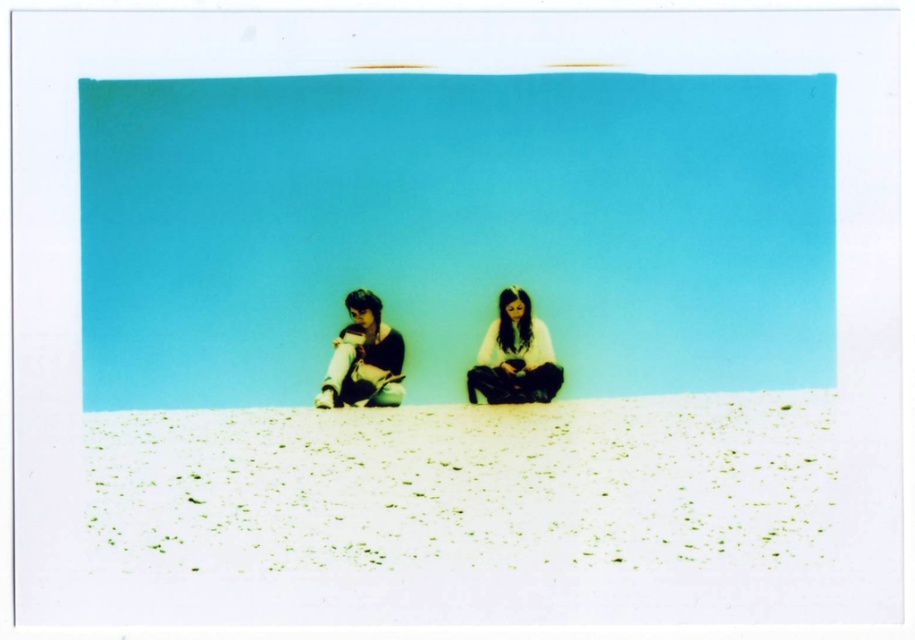
Question: Which of the following is the closest to the observer?

Choices:
 (A) white sandy ground at lower center
 (B) white matte shirt at center
 (C) matte white pants at center left

Answer: (A)

Question: Does white matte shirt at center appear on the right side of matte white pants at center left?

Choices:
 (A) yes
 (B) no

Answer: (A)

Question: Estimate the real-world distances between objects in this image. Which object is closer to the white matte shirt at center?

Choices:
 (A) matte white pants at center left
 (B) white sandy ground at lower center

Answer: (B)

Question: Does white sandy ground at lower center have a lesser width compared to white matte shirt at center?

Choices:
 (A) no
 (B) yes

Answer: (A)

Question: Which point is closer to the camera?

Choices:
 (A) (555, 557)
 (B) (513, 321)

Answer: (A)

Question: Is white sandy ground at lower center above matte white pants at center left?

Choices:
 (A) no
 (B) yes

Answer: (A)